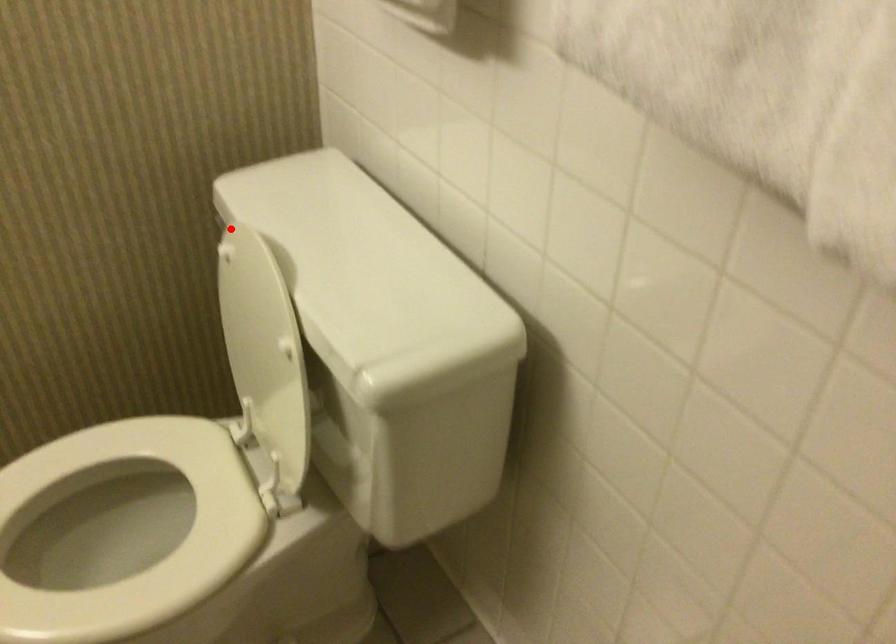
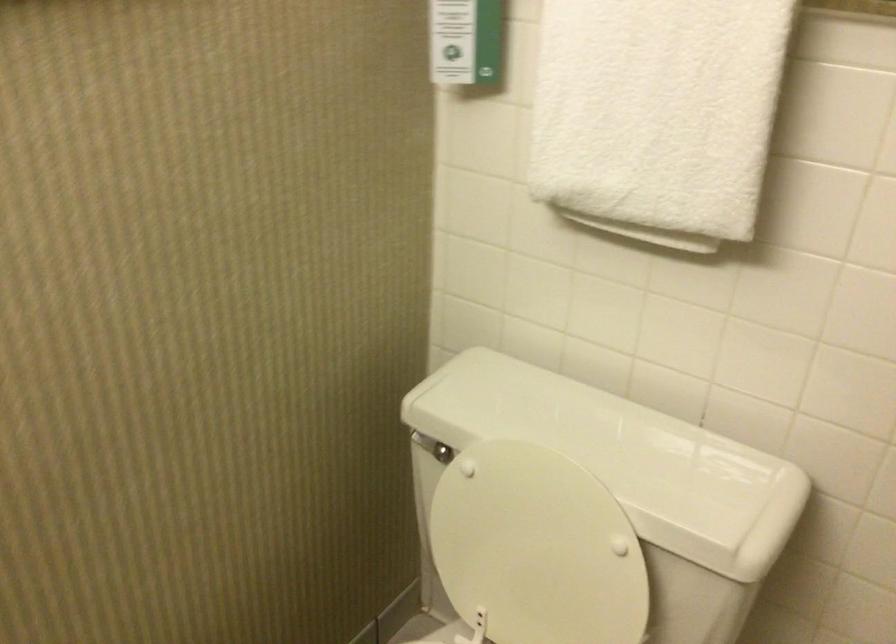
Question: I am providing you with two images of the same scene from different viewpoints. A red point is shown in image1. For the corresponding object point in image2, is it positioned nearer or farther from the camera?

Choices:
 (A) Nearer
 (B) Farther

Answer: (B)